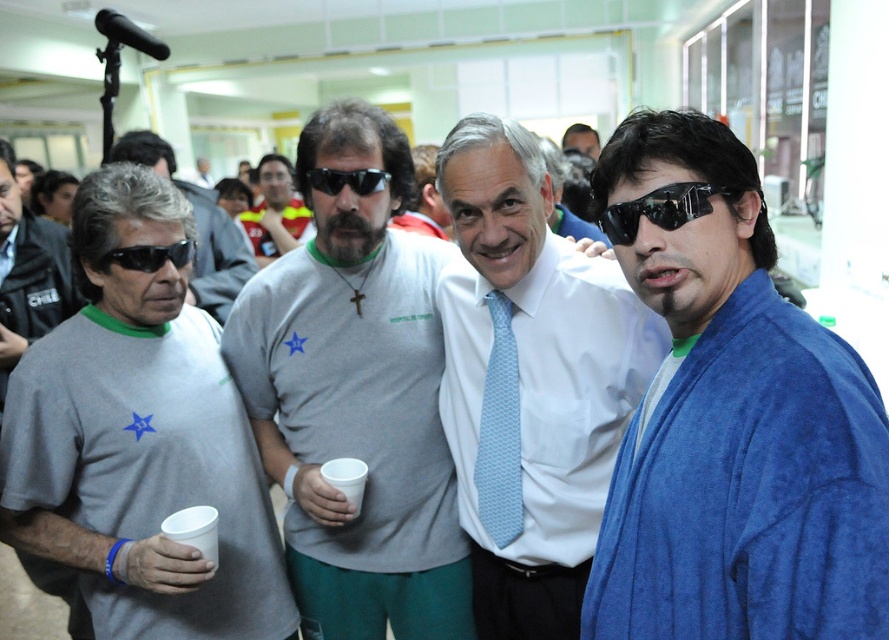
Question: Which of these objects is positioned closest to the matte black sunglasses at center?

Choices:
 (A) matte gray t-shirt at center
 (B) light blue textured tie at center

Answer: (A)

Question: Which is farther from the blue textured robe at right?

Choices:
 (A) matte black goggles at left
 (B) gray fabric shirt at left
 (C) matte black sunglasses at center
 (D) matte gray shirt at left

Answer: (C)

Question: Observing the image, what is the correct spatial positioning of gray fabric shirt at left in reference to black plastic sunglasses at center?

Choices:
 (A) below
 (B) above

Answer: (A)

Question: Considering the relative positions of blue textured robe at right and black plastic sunglasses at center in the image provided, where is blue textured robe at right located with respect to black plastic sunglasses at center?

Choices:
 (A) left
 (B) right

Answer: (B)

Question: Which of the following is the closest to the observer?

Choices:
 (A) black plastic sunglasses at center
 (B) blue textured robe at right

Answer: (B)

Question: Is light blue textured tie at center behind matte black goggles at left?

Choices:
 (A) no
 (B) yes

Answer: (B)